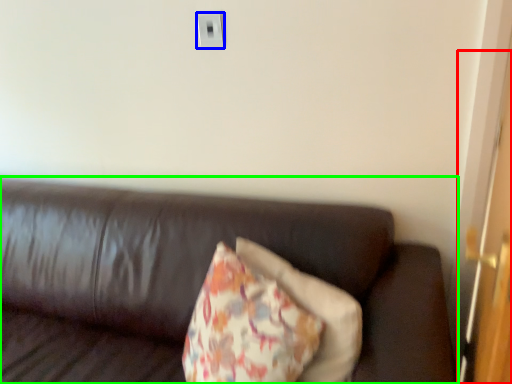
Question: Considering the real-world distances, which object is farthest from door (highlighted by a red box)? electric outlet (highlighted by a blue box) or studio couch (highlighted by a green box)?

Choices:
 (A) electric outlet
 (B) studio couch

Answer: (A)